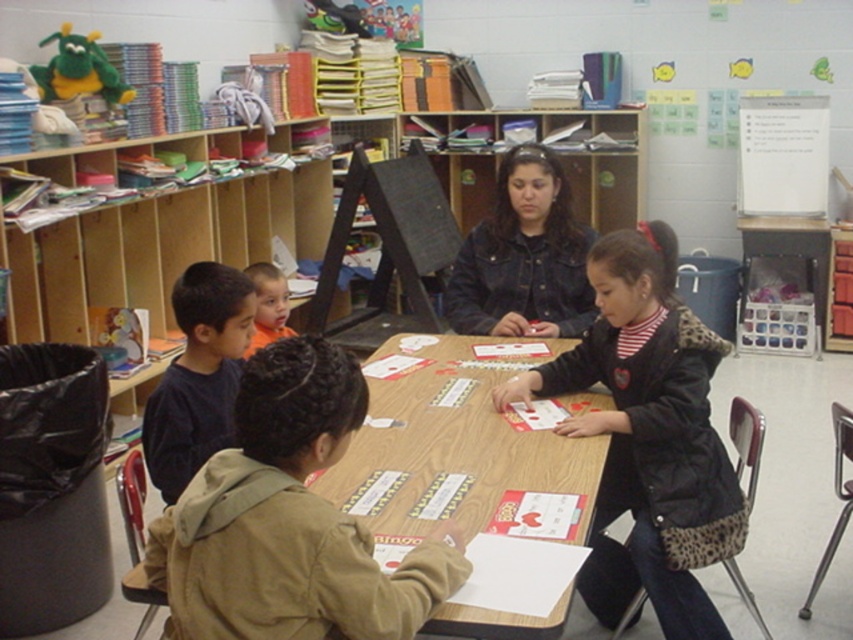
From the picture: Is khaki fleece jacket at center positioned before denim jacket at center?

Yes, it is.

Measure the distance between point (260, 531) and camera.

Point (260, 531) and camera are 4.13 feet apart.

Where is `khaki fleece jacket at center`? khaki fleece jacket at center is located at coordinates (289, 520).

Which is above, dark blue shirt at left or orange shirt at left?

orange shirt at left is above.

Is point (158, 432) farther from viewer compared to point (252, 346)?

No, it is not.

You are a GUI agent. You are given a task and a screenshot of the screen. Output one action in this format:
    pyautogui.click(x=<x>, y=<y>)
    Task: Click on the dark blue shirt at left
    This screenshot has height=640, width=853.
    Given the screenshot: What is the action you would take?
    pyautogui.click(x=198, y=376)

Is denim jacket at center thinner than dark blue shirt at left?

Incorrect, denim jacket at center's width is not less than dark blue shirt at left's.

Can you confirm if denim jacket at center is shorter than dark blue shirt at left?

No.

What do you see at coordinates (523, 257) in the screenshot?
I see `denim jacket at center` at bounding box center [523, 257].

Locate an element on the screen. The width and height of the screenshot is (853, 640). denim jacket at center is located at coordinates (523, 257).